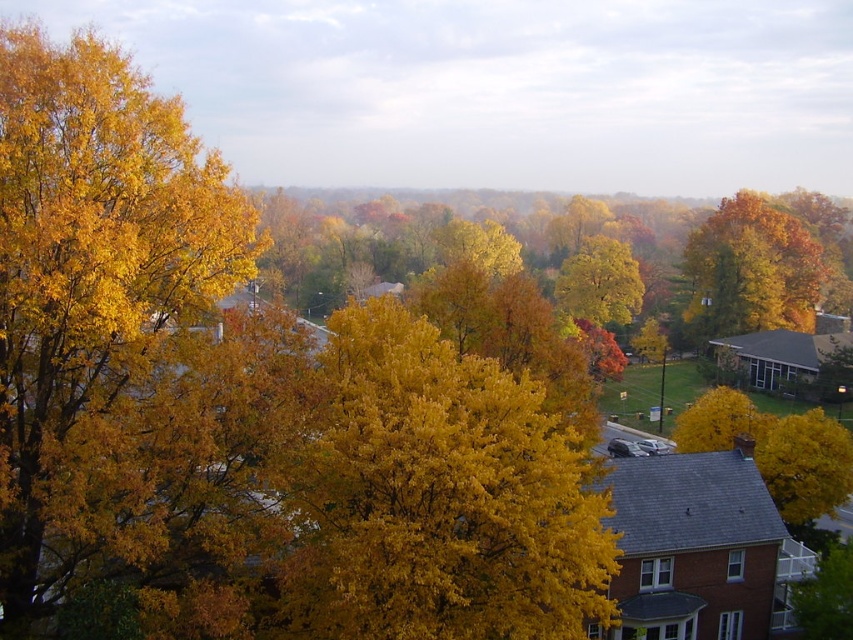
You are standing in the autumn landscape and notice two clusters of golden yellow leaves at left and golden yellow leaves at center. Which cluster appears closer to you?

The golden yellow leaves at left appears closer to you because it is positioned in front of the golden yellow leaves at center.

You are an artist painting this autumn scene. You want to highlight the contrast between the golden yellow leaves at left and the golden yellow leaves at center. Which set of leaves should you paint with a thicker brush stroke to emphasize their visual weight?

The golden yellow leaves at center should be painted with a thicker brush stroke because they are thicker than the golden yellow leaves at left, making them naturally more visually weighty.

You are standing in the autumnal landscape and want to take a photo of the golden yellow leaves at upper right. Where exactly should you aim your camera to capture them?

You should aim your camera at point [750,269] to capture the golden yellow leaves at upper right.